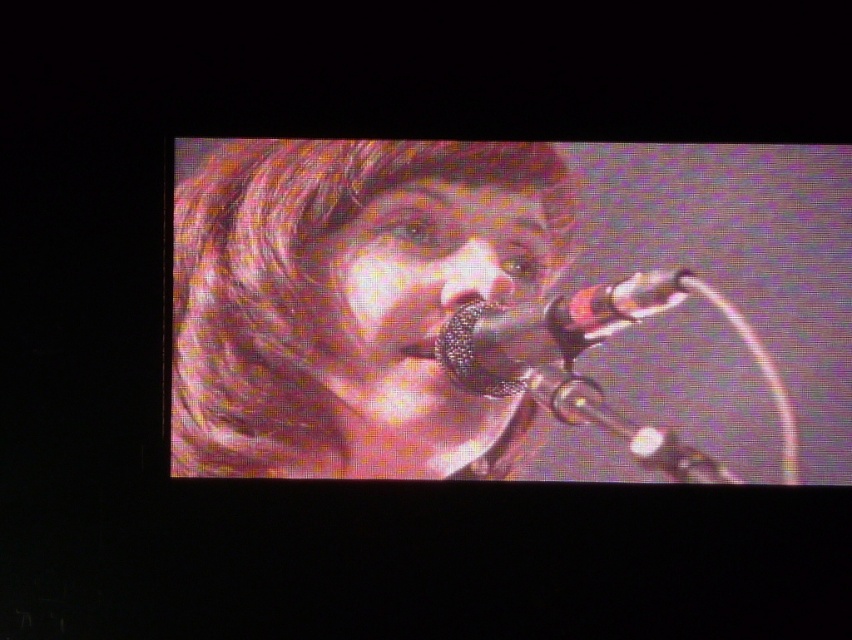
Question: Can you confirm if shiny black microphone at center is positioned to the right of metallic mesh microphone at center?

Choices:
 (A) no
 (B) yes

Answer: (A)

Question: Is shiny black microphone at center behind metallic mesh microphone at center?

Choices:
 (A) no
 (B) yes

Answer: (B)

Question: Which object is closer to the camera taking this photo?

Choices:
 (A) shiny black microphone at center
 (B) metallic mesh microphone at center

Answer: (B)

Question: Can you confirm if shiny black microphone at center is bigger than metallic mesh microphone at center?

Choices:
 (A) yes
 (B) no

Answer: (A)

Question: Which point is closer to the camera?

Choices:
 (A) metallic mesh microphone at center
 (B) shiny black microphone at center

Answer: (A)